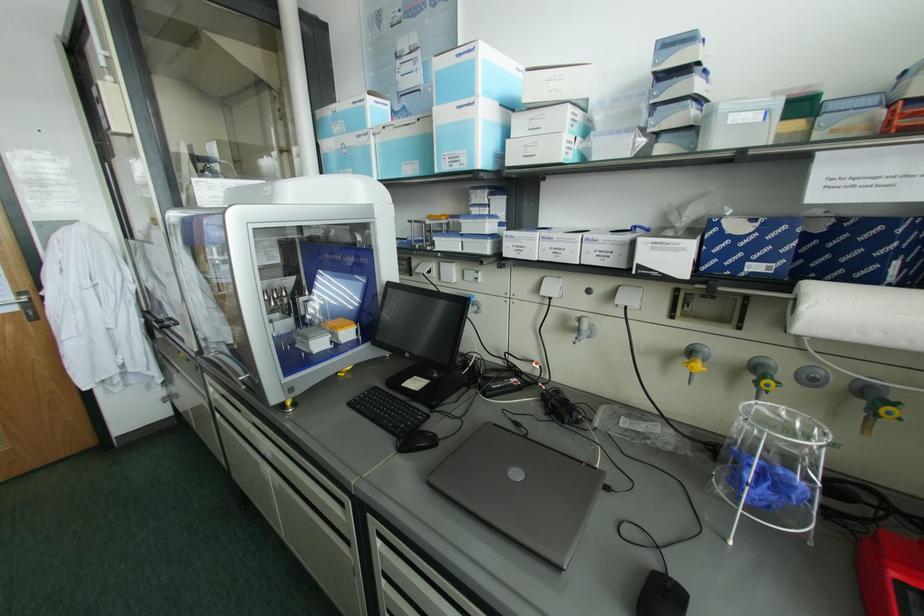
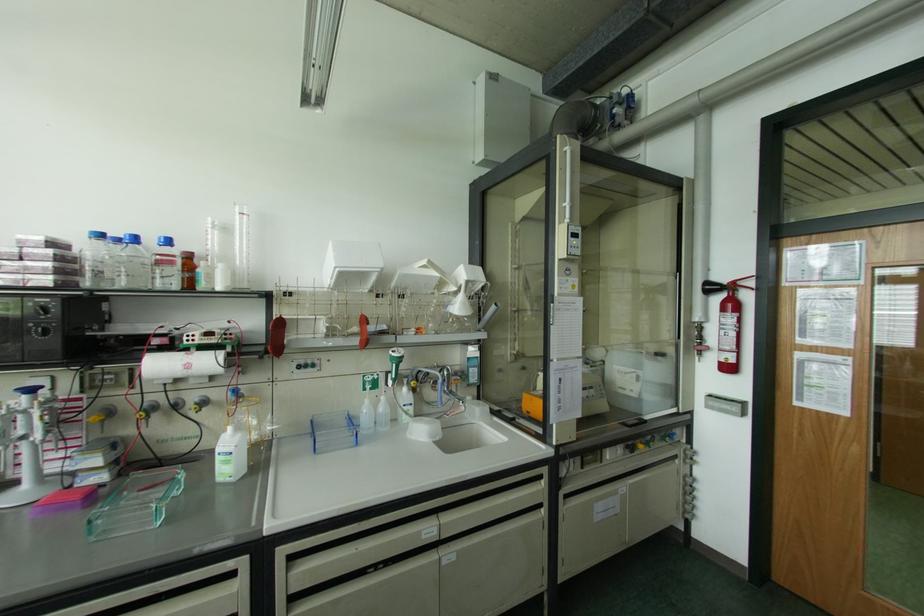
Question: The camera is either moving clockwise (left) or counter-clockwise (right) around the object. The first image is from the beginning of the video and the second image is from the end. Is the camera moving left or right when shooting the video?

Choices:
 (A) Left
 (B) Right

Answer: (B)